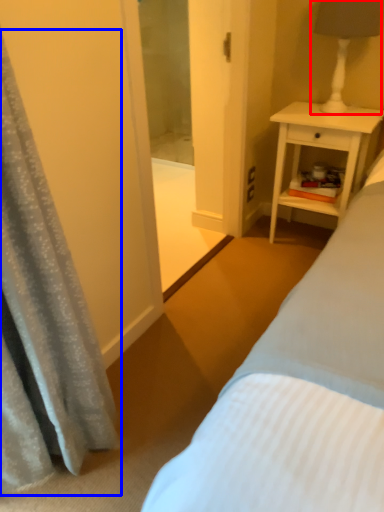
Question: Which of the following is the farthest to the observer, bedside lamp (highlighted by a red box) or curtain (highlighted by a blue box)?

Choices:
 (A) bedside lamp
 (B) curtain

Answer: (A)